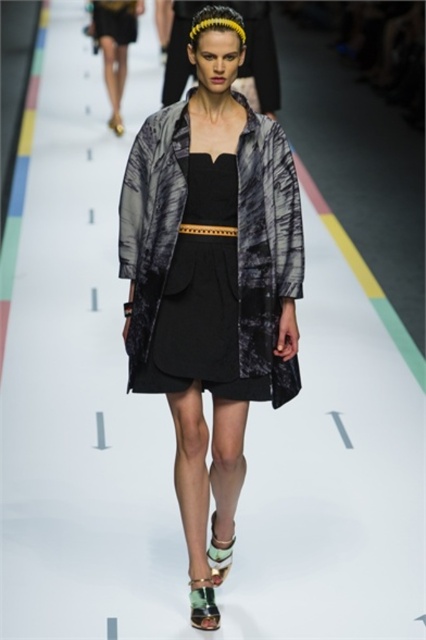
Which is above, black leather belt at center or green suede sandal at center?

Positioned higher is green suede sandal at center.

Locate an element on the screen. black leather belt at center is located at coordinates (207, 228).

Locate an element on the screen. Image resolution: width=426 pixels, height=640 pixels. black leather belt at center is located at coordinates (x=207, y=228).

Which is behind, point (236, 284) or point (117, 115)?

The point (117, 115) is behind.

Locate an element on the screen. This screenshot has height=640, width=426. black textured fabric dress at center is located at coordinates (212, 298).

Can you confirm if textured gray coat at center is positioned to the right of leather textured sandal at lower center?

No, textured gray coat at center is not to the right of leather textured sandal at lower center.

Does point (265, 204) lie in front of point (230, 557)?

Yes, point (265, 204) is in front of point (230, 557).

I want to click on textured gray coat at center, so click(210, 273).